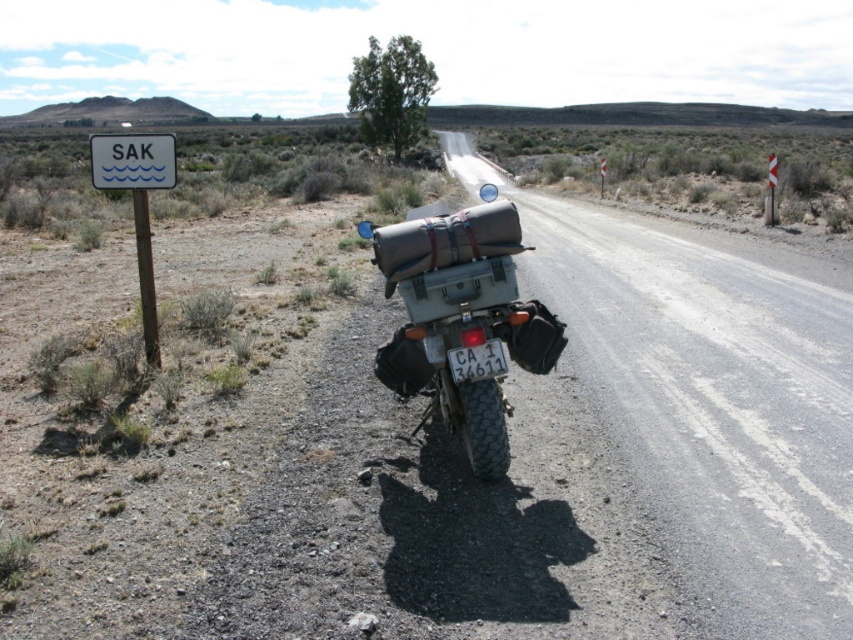
Between white plastic sign at left and white plastic sign at upper left, which one is positioned higher?

white plastic sign at upper left is higher up.

Where is `white plastic sign at left`? Image resolution: width=853 pixels, height=640 pixels. white plastic sign at left is located at coordinates (137, 204).

Based on the photo, who is more distant from viewer, [471,378] or [119,186]?

The point [119,186] is more distant.

Is point (515, 294) positioned in front of point (128, 160)?

Yes, it is in front of point (128, 160).

Is point (496, 460) farther from viewer compared to point (169, 157)?

No, it is not.

This screenshot has width=853, height=640. What are the coordinates of `matte gray luggage at center` in the screenshot? It's located at (461, 321).

Who is lower down, brown leather bag at rear or white plastic sign at upper left?

Positioned lower is white plastic sign at upper left.

Between brown leather bag at rear and white plastic sign at upper left, which one appears on the left side from the viewer's perspective?

Positioned to the left is white plastic sign at upper left.

Is point (412, 237) in front of point (144, 138)?

Yes.

Locate an element on the screen. The width and height of the screenshot is (853, 640). brown leather bag at rear is located at coordinates click(x=444, y=237).